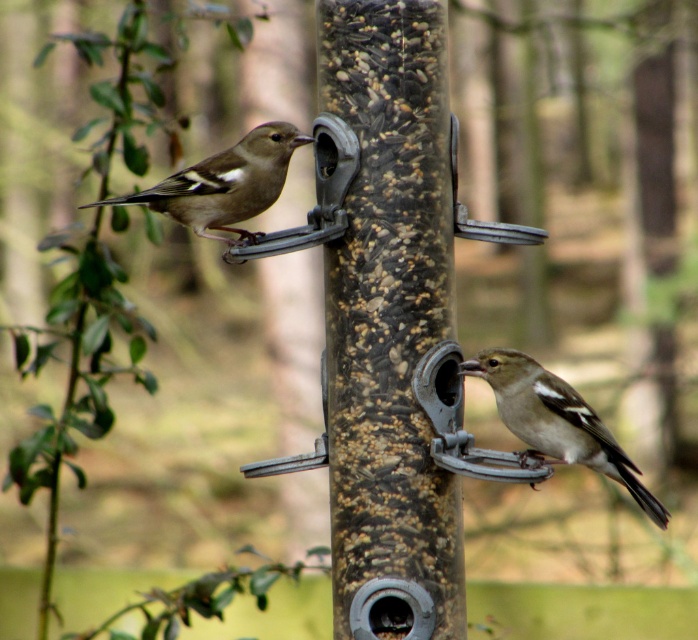
Looking at this image, between brown speckled sparrow at lower right and brown speckled feathers at upper left, which one appears on the left side from the viewer's perspective?

Positioned to the left is brown speckled feathers at upper left.

What do you see at coordinates (556, 420) in the screenshot? The height and width of the screenshot is (640, 698). I see `brown speckled sparrow at lower right` at bounding box center [556, 420].

I want to click on brown speckled sparrow at lower right, so click(556, 420).